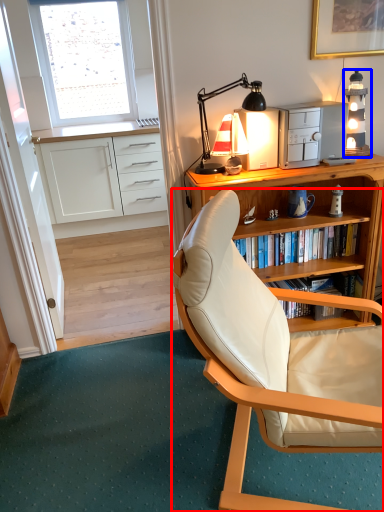
Question: Which of the following is the closest to the observer, chair (highlighted by a red box) or lamp (highlighted by a blue box)?

Choices:
 (A) chair
 (B) lamp

Answer: (A)